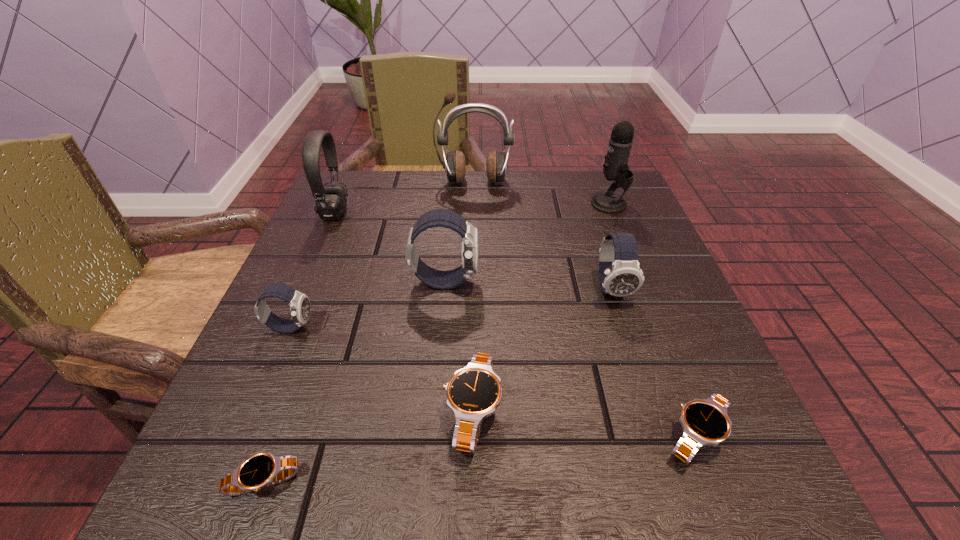
Locate an element on the screen. free spot that satisfies the following two spatial constraints: 1. on the face of the second biggest dark watch; 2. on the face of the leftmost dark watch is located at coordinates (624, 327).

What are the coordinates of `blank area in the image that satisfies the following two spatial constraints: 1. on the ear pads of the brown earphone; 2. on the face of the tallest watch` in the screenshot? It's located at (472, 281).

Find the location of a particular element. This screenshot has width=960, height=540. vacant space that satisfies the following two spatial constraints: 1. on the ear pads of the earphone; 2. on the face of the tallest watch is located at coordinates (472, 281).